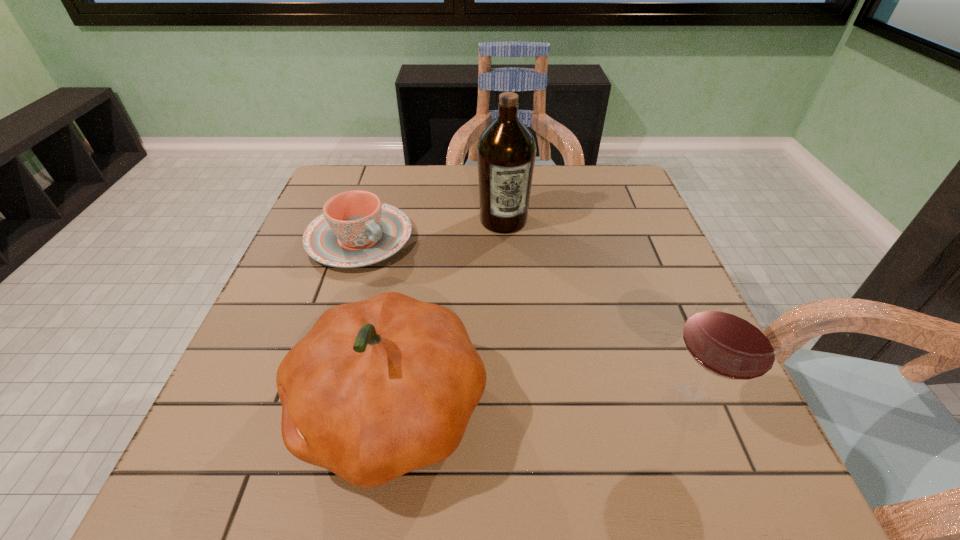
Locate an element on the screen. The height and width of the screenshot is (540, 960). unoccupied position between the rightmost object and the pumpkin is located at coordinates (540, 408).

At what (x,y) coordinates should I click in order to perform the action: click on vacant region between the rightmost object and the pumpkin. Please return your answer as a coordinate pair (x, y). This screenshot has width=960, height=540. Looking at the image, I should click on (540, 408).

Select which object is the closest to the wineglass. Please provide its 2D coordinates. Your answer should be formatted as a tuple, i.e. [(x, y)], where the tuple contains the x and y coordinates of a point satisfying the conditions above.

[(377, 388)]

Where is `object that can be found as the second closest to the shortest object`? object that can be found as the second closest to the shortest object is located at coordinates (377, 388).